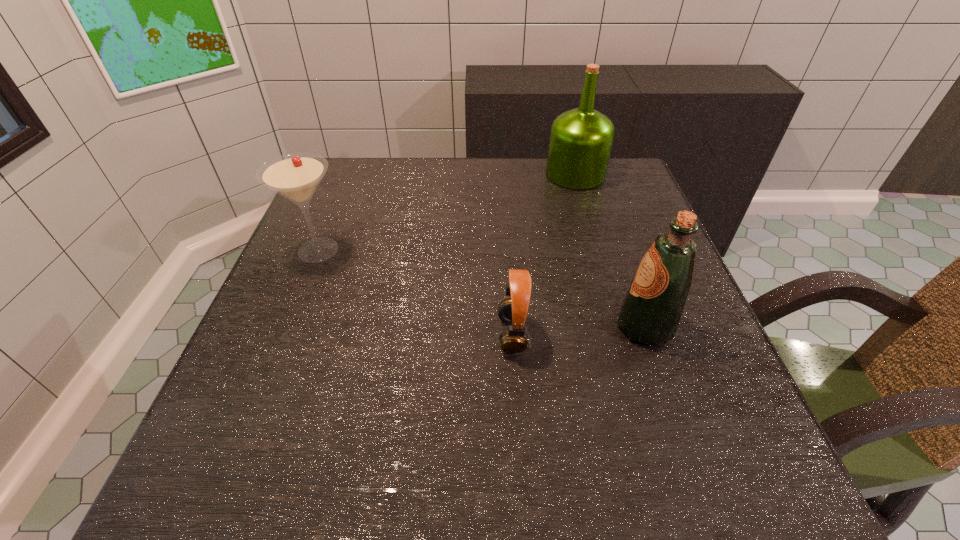
You are a GUI agent. You are given a task and a screenshot of the screen. Output one action in this format:
    pyautogui.click(x=<x>, y=<y>)
    Task: Click on the free space located on the right of the martini
    The image size is (960, 540).
    Given the screenshot: What is the action you would take?
    pyautogui.click(x=389, y=250)

The width and height of the screenshot is (960, 540). Find the location of `free space located 0.200m on the ear cups of the second object from left to right`. free space located 0.200m on the ear cups of the second object from left to right is located at coordinates (389, 334).

Where is `free spot located on the ear cups of the second object from left to right`? Image resolution: width=960 pixels, height=540 pixels. free spot located on the ear cups of the second object from left to right is located at coordinates (449, 334).

Where is `vacant region located on the ear cups of the second object from left to right`? The width and height of the screenshot is (960, 540). vacant region located on the ear cups of the second object from left to right is located at coordinates (421, 334).

Image resolution: width=960 pixels, height=540 pixels. I want to click on object located in the far edge section of the desktop, so click(x=581, y=140).

Identify the location of object present at the left edge. (295, 176).

At what (x,y) coordinates should I click in order to perform the action: click on object positioned at the far right corner. Please return your answer as a coordinate pair (x, y). Looking at the image, I should click on (581, 140).

I want to click on vacant position at the far edge of the desktop, so click(x=452, y=158).

I want to click on free spot at the near edge of the desktop, so click(x=300, y=485).

You are a GUI agent. You are given a task and a screenshot of the screen. Output one action in this format:
    pyautogui.click(x=<x>, y=<y>)
    Task: Click on the vacant space at the left edge
    The height and width of the screenshot is (540, 960).
    Given the screenshot: What is the action you would take?
    pyautogui.click(x=288, y=437)